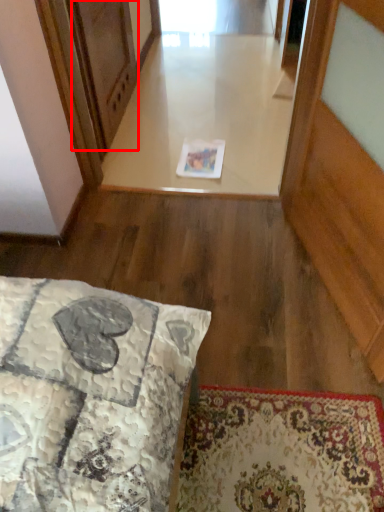
Question: From the image's perspective, what is the correct spatial positioning of screen door (annotated by the red box) in reference to window?

Choices:
 (A) below
 (B) above

Answer: (B)